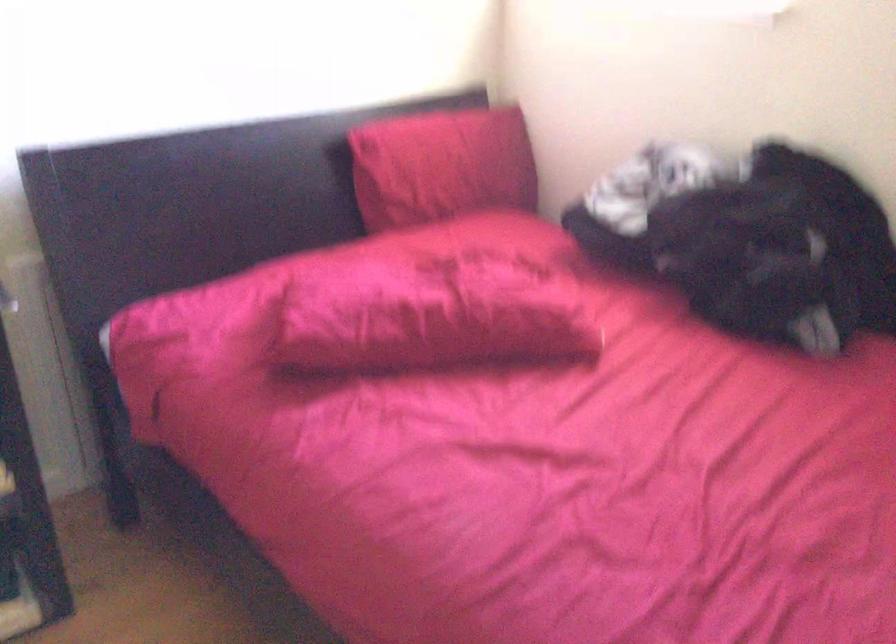
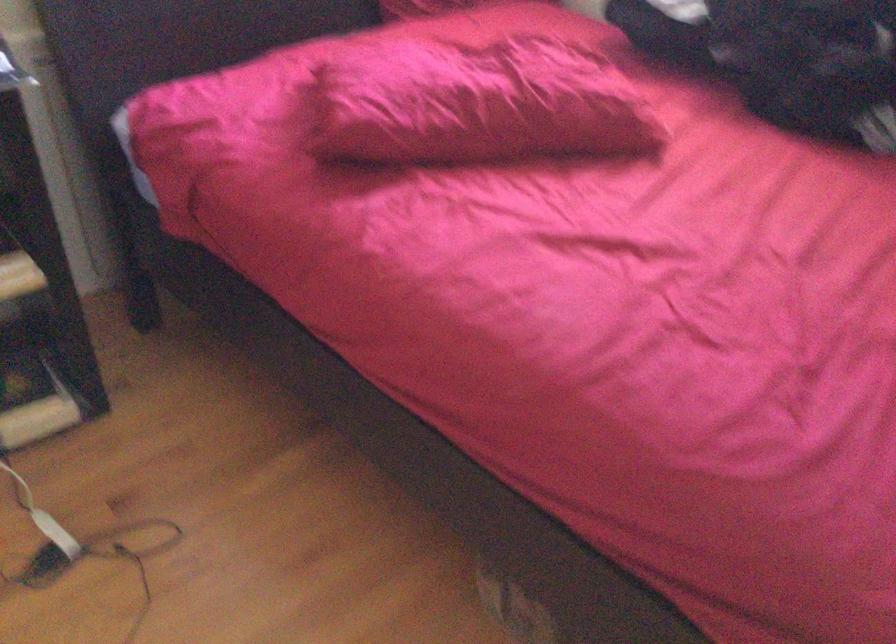
In the second image, find the point that corresponds to (x=416, y=317) in the first image.

(477, 104)